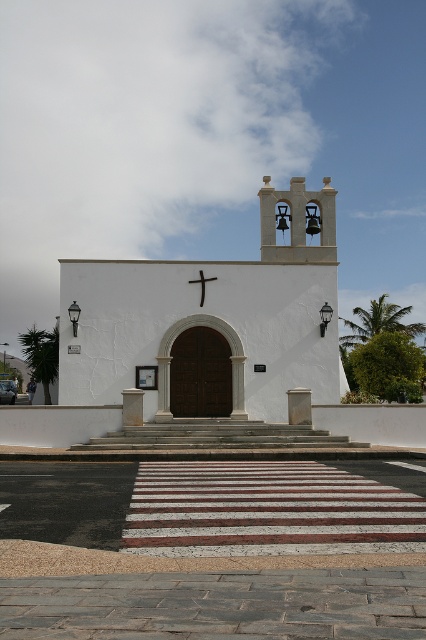
Question: Which object is positioned farthest from the white stucco bell tower at upper center?

Choices:
 (A) black wooden cross at center
 (B) white stucco chapel at center
 (C) white stone stairs at center

Answer: (C)

Question: Is white stucco chapel at center thinner than black wooden cross at center?

Choices:
 (A) yes
 (B) no

Answer: (B)

Question: Based on their relative distances, which object is farther from the white stone stairs at center?

Choices:
 (A) black wooden cross at center
 (B) white stucco bell tower at upper center

Answer: (B)

Question: Can you confirm if white stucco chapel at center is positioned to the right of white stucco bell tower at upper center?

Choices:
 (A) no
 (B) yes

Answer: (A)

Question: Which object is farther from the camera taking this photo?

Choices:
 (A) white stucco bell tower at upper center
 (B) white stone stairs at center
 (C) white stucco chapel at center
 (D) black wooden cross at center

Answer: (A)

Question: Considering the relative positions of white stucco chapel at center and white stone stairs at center in the image provided, where is white stucco chapel at center located with respect to white stone stairs at center?

Choices:
 (A) above
 (B) below

Answer: (A)